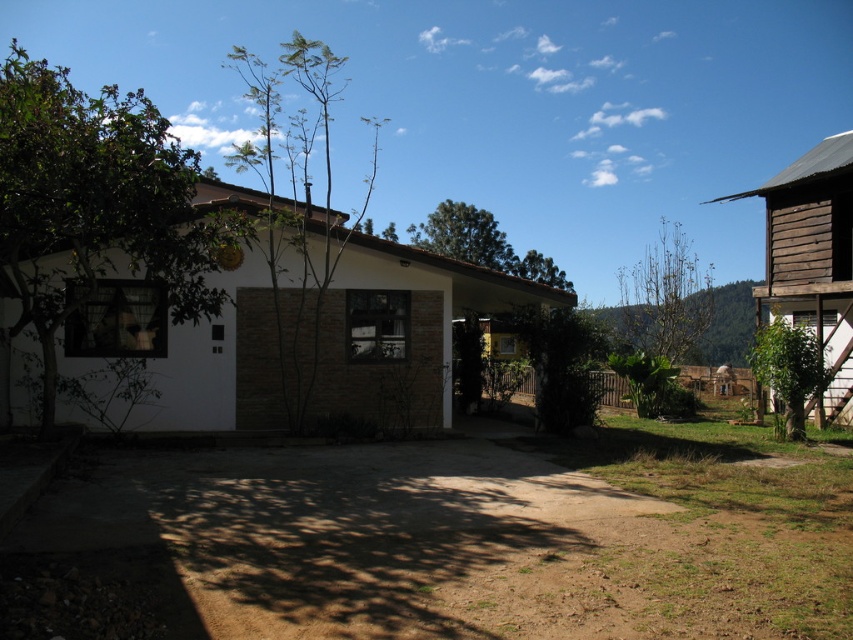
You are a gardener planning to plant a new tree that requires at least 20 meters of space between it and other trees. You have two existing trees in the scene, the brown textured tree at center and the green leafy tree at right. Can you plant the new tree between them without violating the spacing requirement?

The brown textured tree at center is 19.04 meters from the green leafy tree at right. Since the required distance is 20 meters, planting a new tree between them would not meet the spacing requirement as the existing distance is less than the required 20 meters.

You are standing at the point marked by the coordinate point at the bottom center of the image, which is (811, 260). You want to walk towards the wooden hut at right. Which direction should you go?

The point at (811, 260) is already at the wooden hut at right, so you are already there.